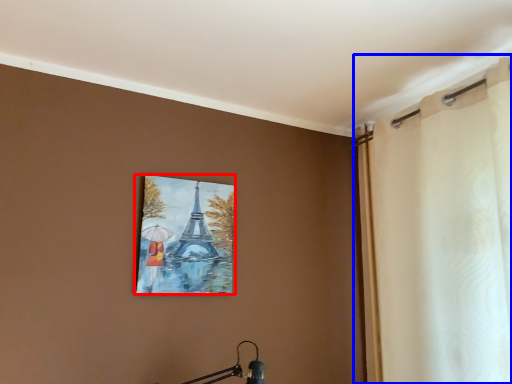
Question: Among these objects, which one is farthest to the camera, picture frame (highlighted by a red box) or curtain (highlighted by a blue box)?

Choices:
 (A) picture frame
 (B) curtain

Answer: (A)